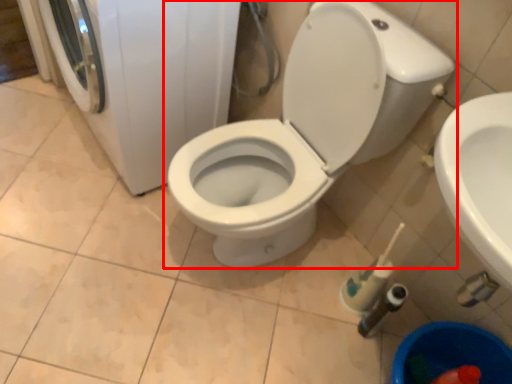
Question: From the image's perspective, what is the correct spatial relationship of toilet (annotated by the red box) in relation to washing machine?

Choices:
 (A) above
 (B) below

Answer: (B)